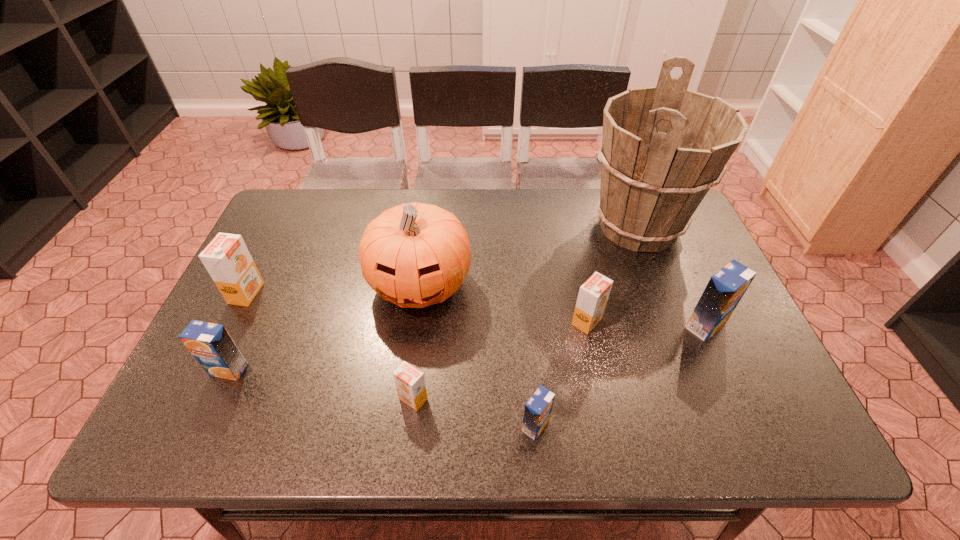
The image size is (960, 540). Find the location of `the tallest object`. the tallest object is located at coordinates (663, 147).

Where is `orange pumpkin`? The height and width of the screenshot is (540, 960). orange pumpkin is located at coordinates (414, 255).

Locate an element on the screen. pumpkin is located at coordinates (414, 255).

Identify the location of the biggest blue orange_juice. The image size is (960, 540). (726, 287).

Where is `the rightmost blue orange_juice`? the rightmost blue orange_juice is located at coordinates (726, 287).

The height and width of the screenshot is (540, 960). In order to click on the farthest orange_juice in this screenshot , I will do `click(227, 259)`.

Where is `the leftmost orange orange juice`? the leftmost orange orange juice is located at coordinates coord(227,259).

This screenshot has height=540, width=960. What are the coordinates of `the second smallest orange orange juice` in the screenshot? It's located at (593, 295).

The height and width of the screenshot is (540, 960). Identify the location of the sixth object from left to right. (593, 295).

Where is `the leftmost blue orange_juice`? The image size is (960, 540). the leftmost blue orange_juice is located at coordinates (211, 345).